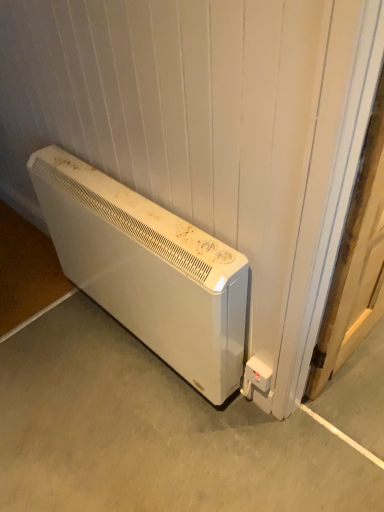
This screenshot has width=384, height=512. Describe the element at coordinates (256, 377) in the screenshot. I see `white plastic electric outlet at lower right` at that location.

What do you see at coordinates (151, 433) in the screenshot?
I see `white matte heater at lower left` at bounding box center [151, 433].

Find the location of `white matte heater at lower left`. white matte heater at lower left is located at coordinates (151, 433).

Describe the element at coordinates (148, 270) in the screenshot. I see `white matte heater at lower left` at that location.

The height and width of the screenshot is (512, 384). I want to click on white plastic electric outlet at lower right, so click(x=256, y=377).

Between white plastic electric outlet at lower right and white matte heater at lower left, which one has smaller size?

With smaller size is white plastic electric outlet at lower right.

Do you think white plastic electric outlet at lower right is within white matte heater at lower left, or outside of it?

white plastic electric outlet at lower right lies outside white matte heater at lower left.

Based on the photo, is white plastic electric outlet at lower right taller than white matte heater at lower left?

In fact, white plastic electric outlet at lower right may be shorter than white matte heater at lower left.

Is the depth of white plastic electric outlet at lower right less than that of white matte heater at lower left?

No, it is behind white matte heater at lower left.

Is point (72, 450) behind point (245, 366)?

Yes, it is.

This screenshot has width=384, height=512. I want to click on concrete in front of the white plastic electric outlet at lower right, so click(x=151, y=433).

Is the position of white matte heater at lower left less distant than that of white plastic electric outlet at lower right?

Yes, white matte heater at lower left is in front of white plastic electric outlet at lower right.

Considering the positions of objects white plastic electric outlet at lower right and white matte heater at lower left in the image provided, who is more to the left, white plastic electric outlet at lower right or white matte heater at lower left?

From the viewer's perspective, white matte heater at lower left appears more on the left side.

Identify the location of electric outlet on the right of the white matte heater at lower left. The width and height of the screenshot is (384, 512). (256, 377).

Which of these two, white plastic electric outlet at lower right or white matte heater at lower left, stands shorter?

white matte heater at lower left.

Can you confirm if white matte heater at lower left is smaller than white matte heater at lower left?

Actually, white matte heater at lower left might be larger than white matte heater at lower left.

Is white matte heater at lower left at the right side of white matte heater at lower left?

In fact, white matte heater at lower left is to the left of white matte heater at lower left.

Is white matte heater at lower left wider than white matte heater at lower left?

Indeed, white matte heater at lower left has a greater width compared to white matte heater at lower left.

Is white matte heater at lower left wider or thinner than white matte heater at lower left?

Considering their sizes, white matte heater at lower left looks slimmer than white matte heater at lower left.

Which is more to the right, white matte heater at lower left or white matte heater at lower left?

white matte heater at lower left is more to the right.

From the image's perspective, is white matte heater at lower left positioned above or below white matte heater at lower left?

From the image's perspective, white matte heater at lower left appears above white matte heater at lower left.

Is white matte heater at lower left oriented away from white matte heater at lower left?

No, white matte heater at lower left's orientation is not away from white matte heater at lower left.

Is white matte heater at lower left to the left of wooden door at right from the viewer's perspective?

Yes.

Locate an element on the screen. The image size is (384, 512). home appliance on the left side of wooden door at right is located at coordinates (148, 270).

What's the angular difference between white matte heater at lower left and wooden door at right's facing directions?

The angular difference between white matte heater at lower left and wooden door at right is 90 degrees.

In terms of width, does wooden door at right look wider or thinner when compared to white matte heater at lower left?

Considering their sizes, wooden door at right looks slimmer than white matte heater at lower left.

Between point (368, 219) and point (126, 220), which one is positioned behind?

The point (126, 220) is more distant.

Looking at the image, does wooden door at right seem bigger or smaller compared to white matte heater at lower left?

wooden door at right is smaller than white matte heater at lower left.

At what (x,y) coordinates should I click in order to perform the action: click on electric outlet on the right of white matte heater at lower left. Please return your answer as a coordinate pair (x, y). The image size is (384, 512). Looking at the image, I should click on (256, 377).

The width and height of the screenshot is (384, 512). I want to click on concrete in front of the white plastic electric outlet at lower right, so pos(151,433).

Based on the photo, which object lies nearer to the anchor point white matte heater at lower left, white plastic electric outlet at lower right or white matte heater at lower left?

white matte heater at lower left lies closer to white matte heater at lower left than the other object.

Based on their spatial positions, is white matte heater at lower left or wooden door at right closer to white matte heater at lower left?

white matte heater at lower left lies closer to white matte heater at lower left than the other object.

From the image, which object appears to be farther from wooden door at right, white matte heater at lower left or white plastic electric outlet at lower right?

white matte heater at lower left is further to wooden door at right.

From the image, which object appears to be nearer to wooden door at right, white plastic electric outlet at lower right or white matte heater at lower left?

white plastic electric outlet at lower right is positioned closer to the anchor wooden door at right.

Based on the photo, based on their spatial positions, is white plastic electric outlet at lower right or wooden door at right closer to white matte heater at lower left?

white plastic electric outlet at lower right is positioned closer to the anchor white matte heater at lower left.

Estimate the real-world distances between objects in this image. Which object is closer to white plastic electric outlet at lower right, white matte heater at lower left or white matte heater at lower left?

Among the two, white matte heater at lower left is located nearer to white plastic electric outlet at lower right.

Estimate the real-world distances between objects in this image. Which object is closer to white matte heater at lower left, wooden door at right or white plastic electric outlet at lower right?

white plastic electric outlet at lower right.

From the image, which object appears to be farther from white matte heater at lower left, white plastic electric outlet at lower right or white matte heater at lower left?

Based on the image, white matte heater at lower left appears to be further to white matte heater at lower left.

Identify the location of electric outlet between white matte heater at lower left and wooden door at right in the horizontal direction. (256, 377).

At what (x,y) coordinates should I click in order to perform the action: click on home appliance between white matte heater at lower left and wooden door at right. Please return your answer as a coordinate pair (x, y). Looking at the image, I should click on (148, 270).

This screenshot has width=384, height=512. Find the location of `home appliance located between white matte heater at lower left and white plastic electric outlet at lower right in the left-right direction`. home appliance located between white matte heater at lower left and white plastic electric outlet at lower right in the left-right direction is located at coordinates (148, 270).

Find the location of a particular element. The width and height of the screenshot is (384, 512). electric outlet between white matte heater at lower left and wooden door at right in the horizontal direction is located at coordinates (256, 377).